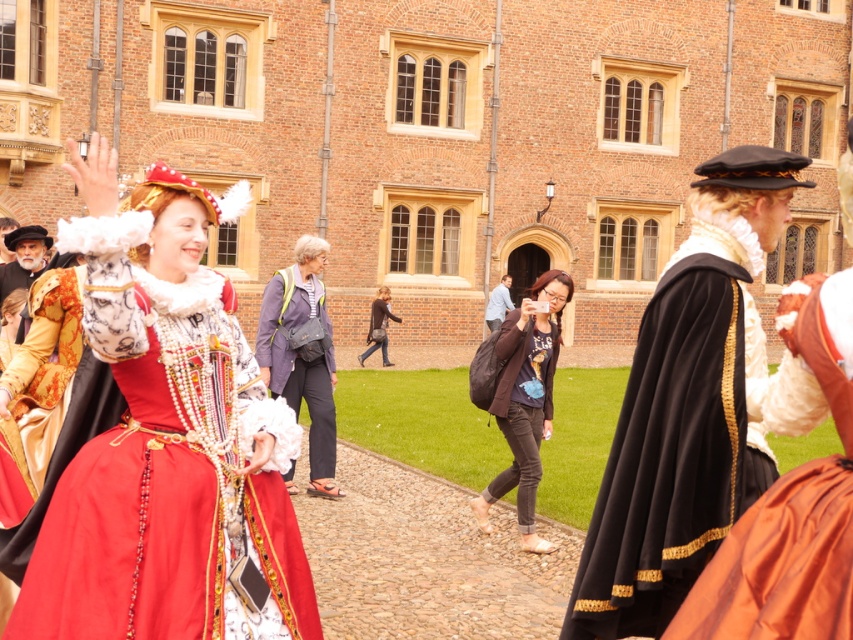
Can you confirm if gray fabric jacket at center is thinner than matte gold hat at upper left?

Yes.

Measure the distance between gray fabric jacket at center and camera.

They are 73.82 feet apart.

Is point (289, 268) positioned before point (19, 276)?

That is True.

The width and height of the screenshot is (853, 640). Find the location of `gray fabric jacket at center`. gray fabric jacket at center is located at coordinates (300, 355).

Is matte gold hat at upper left bigger than smooth blue shirt at center?

Yes.

Is matte gold hat at upper left positioned in front of smooth blue shirt at center?

Yes, matte gold hat at upper left is in front of smooth blue shirt at center.

Is point (13, 285) in front of point (492, 300)?

Yes, it is in front of point (492, 300).

At what (x,y) coordinates should I click in order to perform the action: click on matte gold hat at upper left. Please return your answer as a coordinate pair (x, y). Image resolution: width=853 pixels, height=640 pixels. Looking at the image, I should click on (22, 257).

Is the position of velvet black cape at center less distant than that of gray fabric jacket at center?

Yes, velvet black cape at center is closer to the viewer.

Between velvet black cape at center and gray fabric jacket at center, which one appears on the right side from the viewer's perspective?

velvet black cape at center

Identify the location of velvet black cape at center. (688, 406).